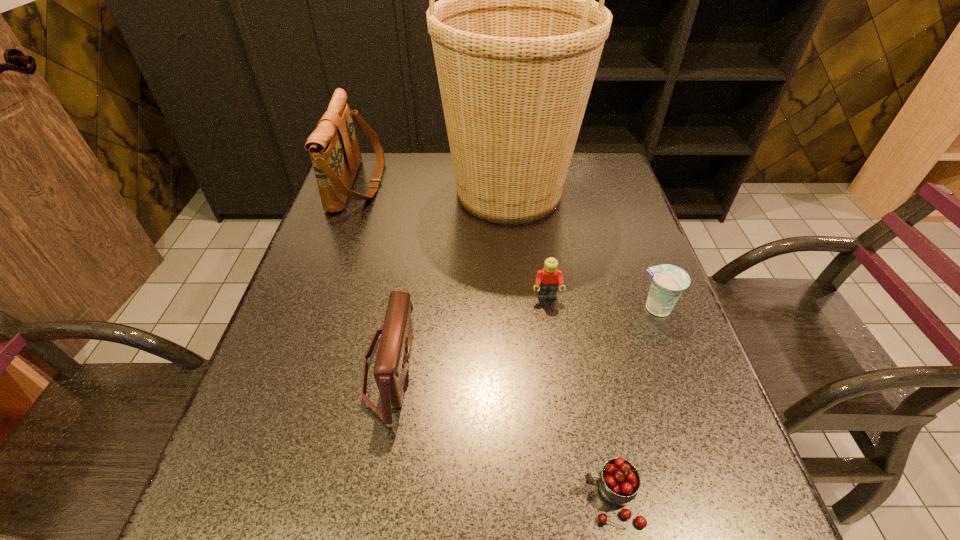
Where is `the third closest object to the basket`? This screenshot has width=960, height=540. the third closest object to the basket is located at coordinates (668, 282).

Image resolution: width=960 pixels, height=540 pixels. Identify the location of vacant space that satisfies the following two spatial constraints: 1. on the handle side of the rightmost object; 2. on the right side of the nearest object. (574, 308).

Identify the location of vacant space that satisfies the following two spatial constraints: 1. on the front-facing side of the leftmost object; 2. on the handle side of the cherry. (248, 498).

Where is `vacant area that satisfies the following two spatial constraints: 1. on the face of the Lego; 2. on the front flap of the shorter shoulder bag`? The width and height of the screenshot is (960, 540). vacant area that satisfies the following two spatial constraints: 1. on the face of the Lego; 2. on the front flap of the shorter shoulder bag is located at coordinates (557, 368).

The width and height of the screenshot is (960, 540). Find the location of `vacant space that satisfies the following two spatial constraints: 1. on the handle side of the nearest object; 2. on the front flap of the nearer shoulder bag`. vacant space that satisfies the following two spatial constraints: 1. on the handle side of the nearest object; 2. on the front flap of the nearer shoulder bag is located at coordinates (586, 368).

Locate an element on the screen. This screenshot has width=960, height=540. vacant space that satisfies the following two spatial constraints: 1. on the face of the Lego; 2. on the handle side of the nearest object is located at coordinates (576, 498).

The width and height of the screenshot is (960, 540). Find the location of `vacant area in the image that satisfies the following two spatial constraints: 1. on the back side of the basket; 2. on the front-facing side of the leftmost object`. vacant area in the image that satisfies the following two spatial constraints: 1. on the back side of the basket; 2. on the front-facing side of the leftmost object is located at coordinates (x=508, y=183).

The height and width of the screenshot is (540, 960). I want to click on free space that satisfies the following two spatial constraints: 1. on the face of the Lego; 2. on the front flap of the fifth object from right to left, so point(557,368).

The width and height of the screenshot is (960, 540). I want to click on free spot that satisfies the following two spatial constraints: 1. on the handle side of the nearest object; 2. on the front-facing side of the left shoulder bag, so click(x=549, y=183).